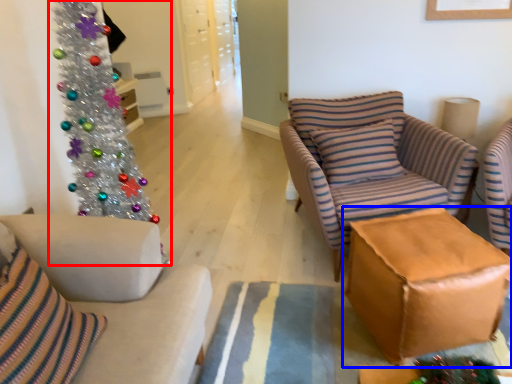
Question: Which point is further to the camera, christmas tree (highlighted by a red box) or table (highlighted by a blue box)?

Choices:
 (A) christmas tree
 (B) table

Answer: (B)